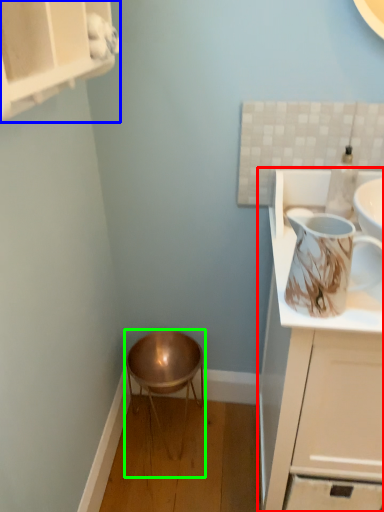
Question: Which object is the farthest from cabinetry (highlighted by a red box)? Choose among these: cabinetry (highlighted by a blue box) or stool (highlighted by a green box).

Choices:
 (A) cabinetry
 (B) stool

Answer: (A)